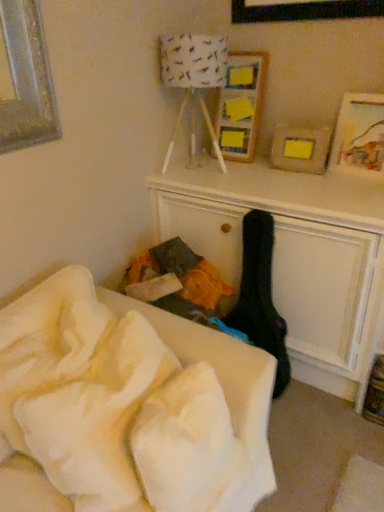
Question: Can you confirm if white paper lampshade at upper center is taller than black fabric guitar case at center?

Choices:
 (A) no
 (B) yes

Answer: (A)

Question: Is white paper lampshade at upper center at the left side of black fabric guitar case at center?

Choices:
 (A) yes
 (B) no

Answer: (A)

Question: Can you confirm if white paper lampshade at upper center is positioned to the right of black fabric guitar case at center?

Choices:
 (A) yes
 (B) no

Answer: (B)

Question: From the image's perspective, is white paper lampshade at upper center above black fabric guitar case at center?

Choices:
 (A) no
 (B) yes

Answer: (B)

Question: From the image's perspective, does white paper lampshade at upper center appear lower than black fabric guitar case at center?

Choices:
 (A) no
 (B) yes

Answer: (A)

Question: Is white paper lampshade at upper center smaller than black fabric guitar case at center?

Choices:
 (A) yes
 (B) no

Answer: (B)

Question: Is white soft blanket at lower left bigger than black fabric guitar case at center?

Choices:
 (A) yes
 (B) no

Answer: (A)

Question: From a real-world perspective, is white soft blanket at lower left on black fabric guitar case at center?

Choices:
 (A) no
 (B) yes

Answer: (B)

Question: Can you confirm if white soft blanket at lower left is wider than black fabric guitar case at center?

Choices:
 (A) no
 (B) yes

Answer: (B)

Question: Does white soft blanket at lower left lie in front of black fabric guitar case at center?

Choices:
 (A) yes
 (B) no

Answer: (A)

Question: From a real-world perspective, is white soft blanket at lower left physically below black fabric guitar case at center?

Choices:
 (A) yes
 (B) no

Answer: (B)

Question: Considering the relative sizes of white soft blanket at lower left and black fabric guitar case at center in the image provided, is white soft blanket at lower left smaller than black fabric guitar case at center?

Choices:
 (A) yes
 (B) no

Answer: (B)

Question: Can you confirm if wooden picture frame at upper center, which is counted as the first picture frame, starting from the left, is shorter than white paper lampshade at upper center?

Choices:
 (A) yes
 (B) no

Answer: (A)